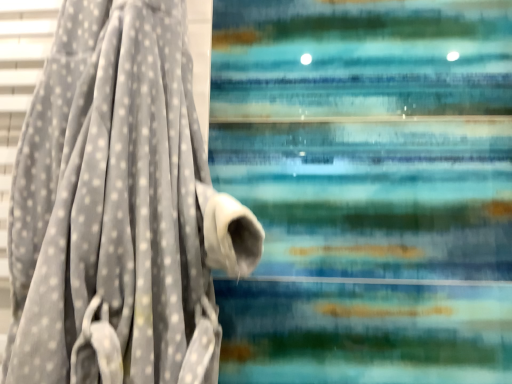
This screenshot has width=512, height=384. I want to click on velvet gray curtain at left, so click(x=119, y=208).

This screenshot has width=512, height=384. Describe the element at coordinates (119, 208) in the screenshot. I see `velvet gray curtain at left` at that location.

The width and height of the screenshot is (512, 384). I want to click on velvet gray curtain at left, so click(x=119, y=208).